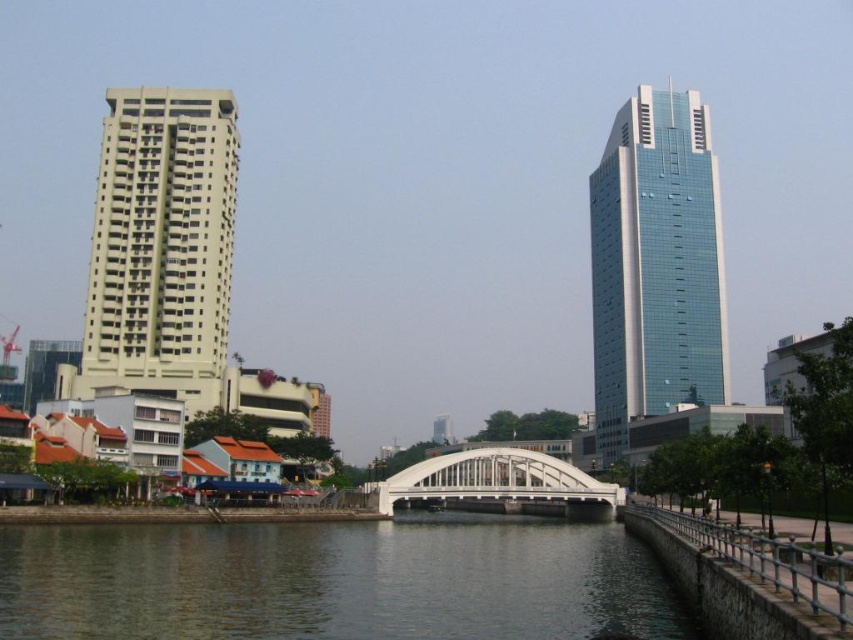
Question: Does clear water at center appear over white metallic bridge at center?

Choices:
 (A) no
 (B) yes

Answer: (B)

Question: Observing the image, what is the correct spatial positioning of beige concrete building at left in reference to blue glass skyscraper at right?

Choices:
 (A) left
 (B) right

Answer: (A)

Question: Which object is positioned closest to the beige concrete building at left?

Choices:
 (A) clear water at center
 (B) white metallic bridge at center
 (C) blue glass skyscraper at right

Answer: (B)

Question: Which is farther from the white metallic bridge at center?

Choices:
 (A) blue glass skyscraper at right
 (B) clear water at center
 (C) beige concrete building at left

Answer: (A)

Question: Is beige concrete building at left bigger than white metallic bridge at center?

Choices:
 (A) yes
 (B) no

Answer: (B)

Question: Which object is the farthest from the blue glass skyscraper at right?

Choices:
 (A) clear water at center
 (B) beige concrete building at left

Answer: (A)